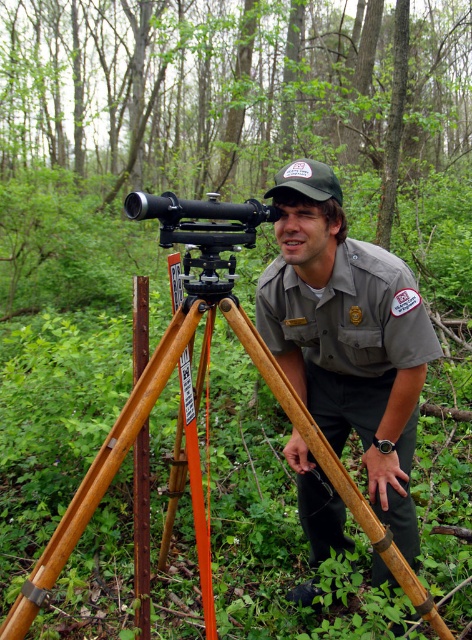
Can you confirm if metallic black telescope at center is smaller than rusty metal pole at center?

Correct, metallic black telescope at center occupies less space than rusty metal pole at center.

Is metallic black telescope at center bigger than rusty metal pole at center?

Incorrect, metallic black telescope at center is not larger than rusty metal pole at center.

Between point (215, 241) and point (136, 582), which one is positioned in front?

Point (215, 241) is more forward.

You are a GUI agent. You are given a task and a screenshot of the screen. Output one action in this format:
    pyautogui.click(x=<x>, y=<y>)
    Task: Click on the metallic black telescope at center
    The image size is (472, 640).
    Given the screenshot: What is the action you would take?
    pyautogui.click(x=202, y=234)

Can you confirm if gray uniform at center is positioned below wooden tripod at center?

Actually, gray uniform at center is above wooden tripod at center.

Between gray uniform at center and wooden tripod at center, which one appears on the right side from the viewer's perspective?

Positioned to the right is gray uniform at center.

Is point (295, 593) closer to viewer compared to point (330, 461)?

No, (295, 593) is behind (330, 461).

Find the location of a particular element. The width and height of the screenshot is (472, 640). gray uniform at center is located at coordinates (347, 337).

Is point (151, 369) positioned behind point (143, 340)?

That is False.

Does point (237, 339) come farther from viewer compared to point (140, 333)?

Yes, it is behind point (140, 333).

Identify the location of wooden tripod at center. The height and width of the screenshot is (640, 472). (101, 470).